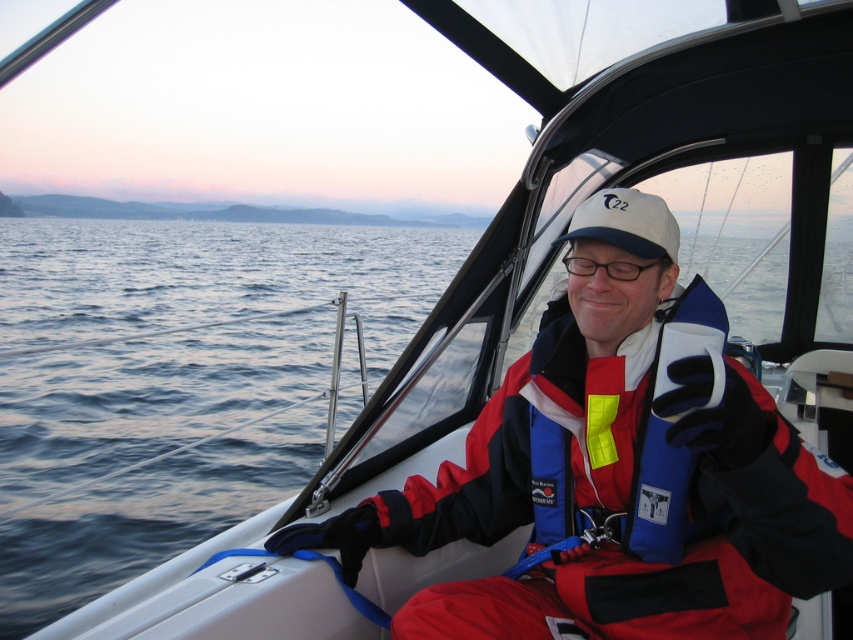
You are a passenger on the boat and want to place both the red fabric jacket at center and the transparent plastic glasses at center on the seat next to you. Which object should you place first to ensure they both fit on the seat?

The red fabric jacket at center is much taller than the transparent plastic glasses at center, so you should place the transparent plastic glasses at center first to make space for the taller jacket.

You are a passenger on the boat and want to put on your red fabric jacket at center and transparent plastic glasses at center. Which item should you pick up first to avoid blocking the other?

You should pick up the transparent plastic glasses at center first because the red fabric jacket at center is positioned under it, so reaching for the jacket first might require moving the glasses.

You are a passenger on the boat and need to grab an item from the front. Which item is easier to reach, the red fabric jacket at center or the transparent plastic glasses at center?

The red fabric jacket at center is closer to the viewer than the transparent plastic glasses at center, so the red fabric jacket at center is easier to reach.